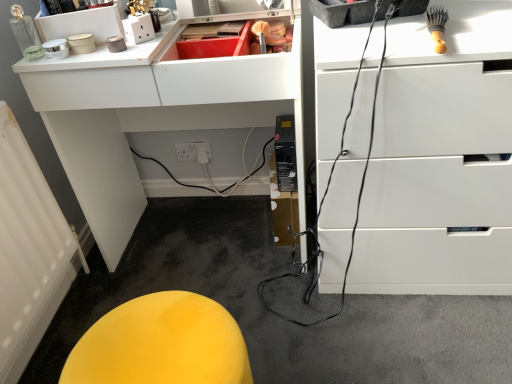
Locate an element on the screen. white textured radiator at lower left is located at coordinates (29, 251).

This screenshot has height=384, width=512. In order to click on yellow fabric stool at lower left in this screenshot , I will do `click(161, 344)`.

Locate an element on the screen. Image resolution: width=512 pixels, height=384 pixels. white glossy chest of drawers at upper right is located at coordinates (440, 161).

Can you confirm if white glossy computer desk at upper center is bigger than yellow fabric stool at lower left?

Indeed, white glossy computer desk at upper center has a larger size compared to yellow fabric stool at lower left.

Can you confirm if white glossy computer desk at upper center is taller than yellow fabric stool at lower left?

Yes.

Are white glossy computer desk at upper center and yellow fabric stool at lower left beside each other?

They are not placed beside each other.

How different are the orientations of white glossy computer desk at upper center and yellow fabric stool at lower left in degrees?

The facing directions of white glossy computer desk at upper center and yellow fabric stool at lower left are 89.2 degrees apart.

Which object is positioned more to the left, wooden-handled brush at upper right or yellow fabric stool at lower left?

From the viewer's perspective, yellow fabric stool at lower left appears more on the left side.

Between wooden-handled brush at upper right and yellow fabric stool at lower left, which one has less height?

wooden-handled brush at upper right.

Find the location of a particular element. The width and height of the screenshot is (512, 384). brush that is behind the yellow fabric stool at lower left is located at coordinates pyautogui.click(x=437, y=27).

How much distance is there between white glossy chest of drawers at upper right and white glossy computer desk at upper center?

A distance of 43.46 centimeters exists between white glossy chest of drawers at upper right and white glossy computer desk at upper center.

Can you confirm if white glossy chest of drawers at upper right is taller than white glossy computer desk at upper center?

Incorrect, the height of white glossy chest of drawers at upper right is not larger of that of white glossy computer desk at upper center.

From a real-world perspective, does white glossy chest of drawers at upper right stand above white glossy computer desk at upper center?

No, from a real-world perspective, white glossy chest of drawers at upper right is not above white glossy computer desk at upper center.

From the picture: Is white glossy chest of drawers at upper right facing away from white glossy computer desk at upper center?

No.

Who is smaller, yellow fabric stool at lower left or white glossy computer desk at upper center?

yellow fabric stool at lower left is smaller.

From the image's perspective, is yellow fabric stool at lower left located beneath white glossy computer desk at upper center?

Yes.

Is yellow fabric stool at lower left in front of or behind white glossy computer desk at upper center in the image?

Visually, yellow fabric stool at lower left is located in front of white glossy computer desk at upper center.

Is yellow fabric stool at lower left aimed at white glossy computer desk at upper center?

No, yellow fabric stool at lower left is not turned towards white glossy computer desk at upper center.

From a real-world perspective, between white textured radiator at lower left and white glossy computer desk at upper center, who is vertically higher?

white glossy computer desk at upper center, from a real-world perspective.

Between white textured radiator at lower left and white glossy computer desk at upper center, which one appears on the right side from the viewer's perspective?

white glossy computer desk at upper center.

Considering the relative sizes of white textured radiator at lower left and white glossy computer desk at upper center in the image provided, is white textured radiator at lower left wider than white glossy computer desk at upper center?

Incorrect, the width of white textured radiator at lower left does not surpass that of white glossy computer desk at upper center.

Between point (2, 241) and point (165, 87), which one is positioned in front?

The point (2, 241) is closer to the camera.

Which of these two, yellow fabric stool at lower left or white textured radiator at lower left, is wider?

yellow fabric stool at lower left is wider.

From the image's perspective, is yellow fabric stool at lower left located above or below white textured radiator at lower left?

From the image's perspective, yellow fabric stool at lower left appears below white textured radiator at lower left.

Who is shorter, yellow fabric stool at lower left or white textured radiator at lower left?

Standing shorter between the two is white textured radiator at lower left.

From a real-world perspective, which is physically above, yellow fabric stool at lower left or white textured radiator at lower left?

In real-world perspective, yellow fabric stool at lower left is above.

Is white glossy chest of drawers at upper right positioned far away from yellow fabric stool at lower left?

Actually, white glossy chest of drawers at upper right and yellow fabric stool at lower left are a little close together.

Is white glossy chest of drawers at upper right surrounding yellow fabric stool at lower left?

That's incorrect, yellow fabric stool at lower left is not inside white glossy chest of drawers at upper right.

From a real-world perspective, is white glossy chest of drawers at upper right below yellow fabric stool at lower left?

Incorrect, from a real-world perspective, white glossy chest of drawers at upper right is higher than yellow fabric stool at lower left.

From the image's perspective, which is above, white glossy chest of drawers at upper right or yellow fabric stool at lower left?

From the image's view, white glossy chest of drawers at upper right is above.

The image size is (512, 384). I want to click on furniture that is in front of the white glossy computer desk at upper center, so pyautogui.click(x=161, y=344).

You are a GUI agent. You are given a task and a screenshot of the screen. Output one action in this format:
    pyautogui.click(x=<x>, y=<y>)
    Task: Click on the brush to the right of yellow fabric stool at lower left
    
    Given the screenshot: What is the action you would take?
    pyautogui.click(x=437, y=27)

Consider the image. Estimate the real-world distances between objects in this image. Which object is further from yellow fabric stool at lower left, white glossy computer desk at upper center or white glossy chest of drawers at upper right?

white glossy computer desk at upper center lies further to yellow fabric stool at lower left than the other object.

When comparing their distances from white glossy computer desk at upper center, does white glossy chest of drawers at upper right or white textured radiator at lower left seem further?

white glossy chest of drawers at upper right is positioned further to the anchor white glossy computer desk at upper center.

Estimate the real-world distances between objects in this image. Which object is closer to white glossy chest of drawers at upper right, white glossy computer desk at upper center or white textured radiator at lower left?

Among the two, white glossy computer desk at upper center is located nearer to white glossy chest of drawers at upper right.

Estimate the real-world distances between objects in this image. Which object is closer to white glossy chest of drawers at upper right, wooden-handled brush at upper right or white textured radiator at lower left?

wooden-handled brush at upper right is positioned closer to the anchor white glossy chest of drawers at upper right.

Estimate the real-world distances between objects in this image. Which object is further from wooden-handled brush at upper right, white textured radiator at lower left or white glossy computer desk at upper center?

Among the two, white textured radiator at lower left is located further to wooden-handled brush at upper right.

Based on their spatial positions, is white glossy chest of drawers at upper right or wooden-handled brush at upper right further from yellow fabric stool at lower left?

wooden-handled brush at upper right lies further to yellow fabric stool at lower left than the other object.

From the image, which object appears to be nearer to white textured radiator at lower left, wooden-handled brush at upper right or yellow fabric stool at lower left?

yellow fabric stool at lower left lies closer to white textured radiator at lower left than the other object.

When comparing their distances from wooden-handled brush at upper right, does yellow fabric stool at lower left or white textured radiator at lower left seem further?

Among the two, white textured radiator at lower left is located further to wooden-handled brush at upper right.

Find the location of a particular element. brush between white textured radiator at lower left and white glossy chest of drawers at upper right is located at coordinates (437, 27).

Image resolution: width=512 pixels, height=384 pixels. Find the location of `furniture situated between white glossy computer desk at upper center and white glossy chest of drawers at upper right from left to right`. furniture situated between white glossy computer desk at upper center and white glossy chest of drawers at upper right from left to right is located at coordinates (161, 344).

At what (x,y) coordinates should I click in order to perform the action: click on brush situated between white glossy computer desk at upper center and white glossy chest of drawers at upper right from left to right. Please return your answer as a coordinate pair (x, y). This screenshot has width=512, height=384. Looking at the image, I should click on (437, 27).

Where is `radiator between white glossy computer desk at upper center and yellow fabric stool at lower left in the vertical direction`? Image resolution: width=512 pixels, height=384 pixels. radiator between white glossy computer desk at upper center and yellow fabric stool at lower left in the vertical direction is located at coordinates [x=29, y=251].